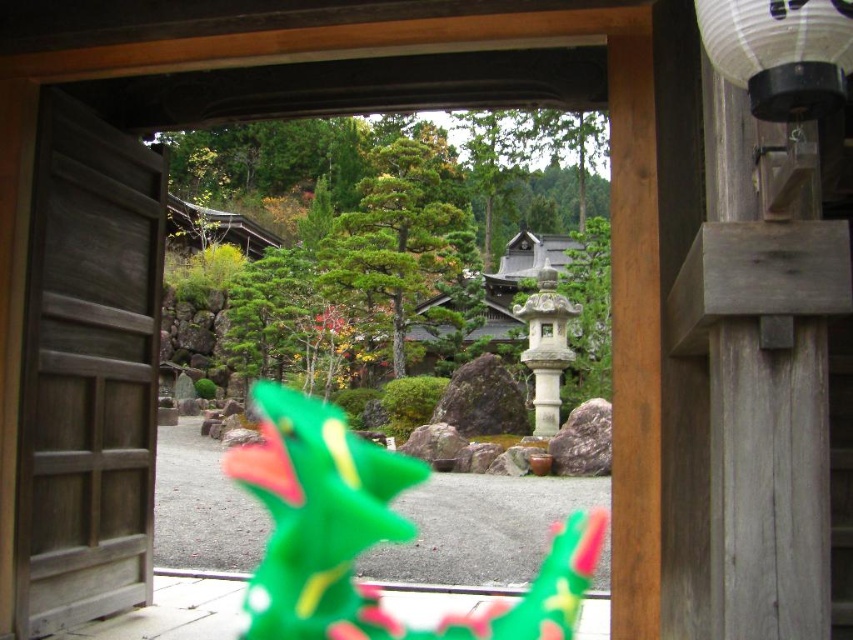
Who is lower down, green plastic dragon at center or white paper lantern at upper right?

→ green plastic dragon at center is below.

Can you confirm if green plastic dragon at center is shorter than white paper lantern at upper right?

In fact, green plastic dragon at center may be taller than white paper lantern at upper right.

This screenshot has height=640, width=853. What do you see at coordinates (369, 534) in the screenshot?
I see `green plastic dragon at center` at bounding box center [369, 534].

Locate an element on the screen. The height and width of the screenshot is (640, 853). green plastic dragon at center is located at coordinates (369, 534).

Identify the location of wooden door at left. (86, 372).

Does wooden door at left have a larger size compared to white paper lantern at upper right?

Yes.

Identify the location of wooden door at left. Image resolution: width=853 pixels, height=640 pixels. (86, 372).

Find the location of a particular element. The image size is (853, 640). wooden door at left is located at coordinates (86, 372).

How much distance is there between wooden door at left and green plastic dragon at center?

The distance of wooden door at left from green plastic dragon at center is 2.79 meters.

Which is behind, point (90, 552) or point (316, 536)?

The point (316, 536) is more distant.

Image resolution: width=853 pixels, height=640 pixels. I want to click on wooden door at left, so click(x=86, y=372).